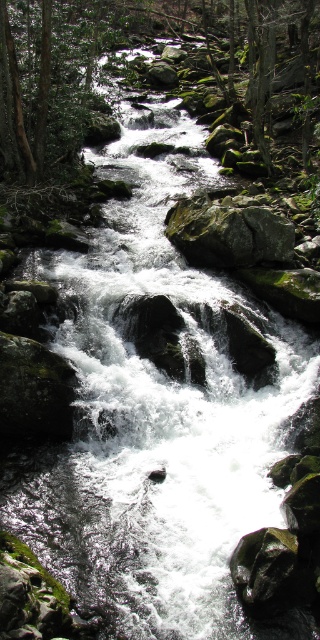
Does green mossy rocks at center appear on the right side of green mossy rock at center?

Yes, green mossy rocks at center is to the right of green mossy rock at center.

Which is in front, point (74, 88) or point (171, 221)?

Point (171, 221) is more forward.

The width and height of the screenshot is (320, 640). Identify the location of green mossy rocks at center. 140,44.